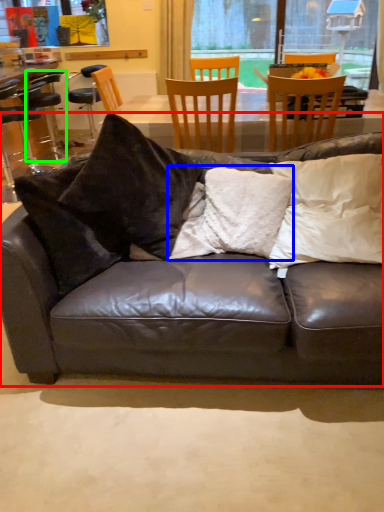
Question: Considering the real-world distances, which object is closest to studio couch (highlighted by a red box)? pillow (highlighted by a blue box) or bar stool (highlighted by a green box).

Choices:
 (A) pillow
 (B) bar stool

Answer: (A)